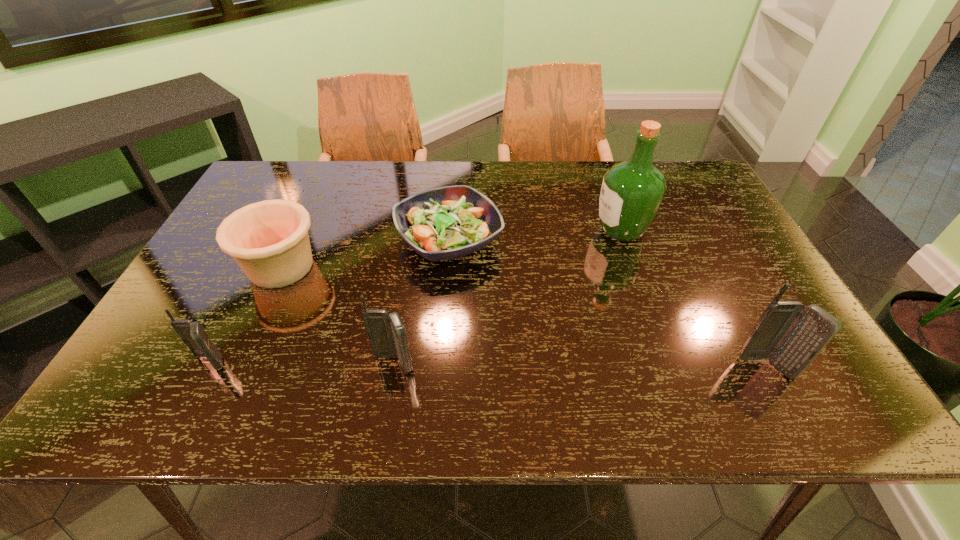
You are a GUI agent. You are given a task and a screenshot of the screen. Output one action in this format:
    pyautogui.click(x=<x>, y=<y>)
    Task: Click on the vacant point that satisfies the following two spatial constraints: 1. on the front-facing side of the liquor; 2. on the keyboard of the second tallest cellular telephone
    
    Given the screenshot: What is the action you would take?
    pyautogui.click(x=669, y=364)